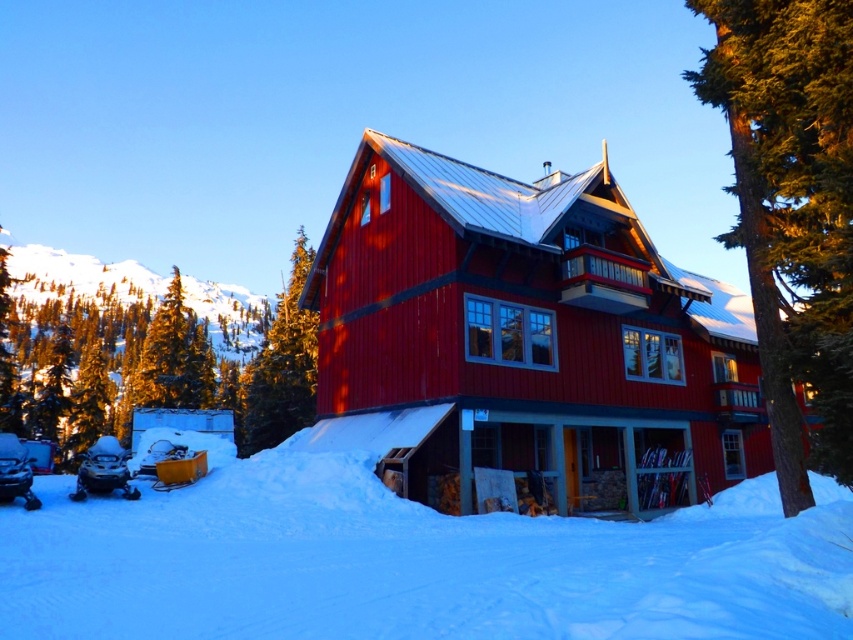
You are standing in front of the cabin and want to take a photo of the green textured pine tree at upper center without the matte red cabin at center blocking the view. Which direction should you move to ensure the cabin is out of the frame?

You should move to the left of the green textured pine tree at upper center because the matte red cabin at center is positioned to its right, so moving left would place the cabin out of the frame.

You are standing at the point marked by the coordinates point (412, 563) in the image of the snowy cabin. What is the primary material you would feel underfoot at this location?

The point (412, 563) indicates white powdery snow at lower center, so the primary material underfoot would be white powdery snow at lower center.